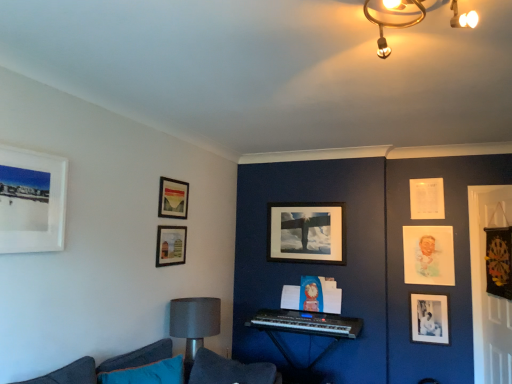
What is the approximate height of pastel paper portrait at right, the 6th picture frame from the front?

pastel paper portrait at right, the 6th picture frame from the front, is 20.11 inches in height.

The width and height of the screenshot is (512, 384). Describe the element at coordinates (499, 261) in the screenshot. I see `velvet black dartboard at right, which is the 1th picture frame in right-to-left order` at that location.

Where is `velvet black dartboard at right, which is the 1th picture frame in right-to-left order`? The height and width of the screenshot is (384, 512). velvet black dartboard at right, which is the 1th picture frame in right-to-left order is located at coordinates (499, 261).

Looking at this image, what is the approximate width of black matte photo frame at lower right, the 4th picture frame in the right-to-left sequence?

It is 1.70 inches.

This screenshot has height=384, width=512. What are the coordinates of `pastel paper portrait at right, which appears as the third picture frame when viewed from the back` in the screenshot? It's located at (428, 255).

Is point (181, 262) positioned in front of point (300, 313)?

Yes, it is.

Considering the positions of objects matte glass picture frame at upper center, acting as the 3th picture frame starting from the front, and black plastic keyboard at center in the image provided, who is more to the right, matte glass picture frame at upper center, acting as the 3th picture frame starting from the front, or black plastic keyboard at center?

black plastic keyboard at center is more to the right.

Between matte glass picture frame at upper center, which appears as the sixth picture frame when viewed from the back, and black plastic keyboard at center, which one has larger width?

With larger width is black plastic keyboard at center.

Between matte glass picture frame at upper center, placed as the 7th picture frame when sorted from right to left, and black plastic keyboard at center, which one has less height?

matte glass picture frame at upper center, placed as the 7th picture frame when sorted from right to left.

From a real-world perspective, is teal fabric pillow at lower left positioned over pastel paper portrait at right, which appears as the third picture frame when viewed from the back, based on gravity?

No.

Which of these two, teal fabric pillow at lower left or pastel paper portrait at right, the 6th picture frame from the left, is smaller?

pastel paper portrait at right, the 6th picture frame from the left, is smaller.

Considering the sizes of objects teal fabric pillow at lower left and pastel paper portrait at right, the 6th picture frame from the front, in the image provided, who is thinner, teal fabric pillow at lower left or pastel paper portrait at right, the 6th picture frame from the front,?

pastel paper portrait at right, the 6th picture frame from the front, is thinner.

Can you confirm if white paper at upper right, which is the seventh picture frame in left-to-right order, is bigger than velvet black dartboard at right, placed as the 2th picture frame when sorted from front to back?

No, white paper at upper right, which is the seventh picture frame in left-to-right order, is not bigger than velvet black dartboard at right, placed as the 2th picture frame when sorted from front to back.

Can you confirm if white paper at upper right, the 7th picture frame positioned from the front, is shorter than velvet black dartboard at right, which is the 7th picture frame in back-to-front order?

Yes, white paper at upper right, the 7th picture frame positioned from the front, is shorter than velvet black dartboard at right, which is the 7th picture frame in back-to-front order.

From the image's perspective, which one is positioned lower, white paper at upper right, which is the seventh picture frame in left-to-right order, or velvet black dartboard at right, which is the 7th picture frame in back-to-front order?

velvet black dartboard at right, which is the 7th picture frame in back-to-front order, is shown below in the image.

From a real-world perspective, which object rests below the other?

In real-world perspective, velvet black dartboard at right, the 8th picture frame viewed from the left, is lower.

What's the angular difference between black plastic keyboard at center and matte wooden picture frame at center, the first picture frame from the back,'s facing directions?

black plastic keyboard at center and matte wooden picture frame at center, the first picture frame from the back, are facing 1.56 degrees away from each other.

Which is behind, point (289, 328) or point (280, 247)?

The point (280, 247) is farther.

Based on their sizes in the image, would you say black plastic keyboard at center is bigger or smaller than matte wooden picture frame at center, which is the fifth picture frame from right to left?

Considering their sizes, black plastic keyboard at center takes up more space than matte wooden picture frame at center, which is the fifth picture frame from right to left.

Is black plastic keyboard at center not close to matte wooden picture frame at center, marked as the 8th picture frame in a front-to-back arrangement?

No, black plastic keyboard at center is not far away from matte wooden picture frame at center, marked as the 8th picture frame in a front-to-back arrangement.

From the image's perspective, which is above, pastel paper portrait at right, the 6th picture frame from the front, or matte black picture frame at upper left, which ranks as the 6th picture frame in right-to-left order?

From the image's view, matte black picture frame at upper left, which ranks as the 6th picture frame in right-to-left order, is above.

Considering the positions of objects pastel paper portrait at right, the 6th picture frame from the left, and matte black picture frame at upper left, which ranks as the 6th picture frame in right-to-left order, in the image provided, who is behind, pastel paper portrait at right, the 6th picture frame from the left, or matte black picture frame at upper left, which ranks as the 6th picture frame in right-to-left order,?

pastel paper portrait at right, the 6th picture frame from the left, is further away from the camera.

Considering the positions of point (412, 243) and point (178, 208), is point (412, 243) closer or farther from the camera than point (178, 208)?

Clearly, point (412, 243) is more distant from the camera than point (178, 208).

Is pastel paper portrait at right, which appears as the third picture frame when viewed from the back, oriented towards matte black picture frame at upper left, arranged as the 4th picture frame when viewed from the front?

No, pastel paper portrait at right, which appears as the third picture frame when viewed from the back, is not facing towards matte black picture frame at upper left, arranged as the 4th picture frame when viewed from the front.

Is black plastic keyboard at center taller than teal fabric pillow at lower left?

Indeed, black plastic keyboard at center has a greater height compared to teal fabric pillow at lower left.

Is black plastic keyboard at center closer to camera compared to teal fabric pillow at lower left?

No, it is not.

Consider the image. Is teal fabric pillow at lower left at the back of black plastic keyboard at center?

No, teal fabric pillow at lower left is not at the back of black plastic keyboard at center.

Looking at this image, is there a large distance between black plastic keyboard at center and teal fabric pillow at lower left?

Yes, black plastic keyboard at center and teal fabric pillow at lower left are quite far apart.

From the image's perspective, who appears lower, gold metallic chandelier at upper center or velvet black dartboard at right, which is the 7th picture frame in back-to-front order?

velvet black dartboard at right, which is the 7th picture frame in back-to-front order, appears lower in the image.

You are a GUI agent. You are given a task and a screenshot of the screen. Output one action in this format:
    pyautogui.click(x=<x>, y=<y>)
    Task: Click on the lamp above the velvet black dartboard at right, which is the 7th picture frame in back-to-front order (from the image's perspective)
    Image resolution: width=512 pixels, height=384 pixels.
    Given the screenshot: What is the action you would take?
    pyautogui.click(x=392, y=22)

Which object is positioned more to the right, gold metallic chandelier at upper center or velvet black dartboard at right, which is the 1th picture frame in right-to-left order?

Positioned to the right is velvet black dartboard at right, which is the 1th picture frame in right-to-left order.

From a real-world perspective, count 4th picture frames upward from the black plastic keyboard at center and point to it. Please provide its 2D coordinates.

[(170, 245)]

At what (x,y) coordinates should I click in order to perform the action: click on pillow below the pastel paper portrait at right, the 6th picture frame from the front (from a real-world perspective). Please return your answer as a coordinate pair (x, y). This screenshot has width=512, height=384. Looking at the image, I should click on [146, 373].

Estimate the real-world distances between objects in this image. Which object is further from black plastic keyboard at center, velvet black dartboard at right, which is the 1th picture frame in right-to-left order, or white matte picture frame at upper left, placed as the first picture frame when sorted from left to right?

Among the two, white matte picture frame at upper left, placed as the first picture frame when sorted from left to right, is located further to black plastic keyboard at center.

From the image, which object appears to be farther from black matte photo frame at lower right, the 4th picture frame in the right-to-left sequence, pastel paper portrait at right, which ranks as the third picture frame in right-to-left order, or black plastic keyboard at center?

black plastic keyboard at center lies further to black matte photo frame at lower right, the 4th picture frame in the right-to-left sequence, than the other object.

Which object lies further to the anchor point gold metallic chandelier at upper center, matte wooden picture frame at center, the first picture frame from the back, or teal fabric pillow at lower left?

Based on the image, matte wooden picture frame at center, the first picture frame from the back, appears to be further to gold metallic chandelier at upper center.

Estimate the real-world distances between objects in this image. Which object is closer to pastel paper portrait at right, the 6th picture frame from the left, velvet black dartboard at right, the 8th picture frame viewed from the left, or teal fabric pillow at lower left?

velvet black dartboard at right, the 8th picture frame viewed from the left, lies closer to pastel paper portrait at right, the 6th picture frame from the left, than the other object.

Considering their positions, is black matte photo frame at lower right, which ranks as the fifth picture frame in front-to-back order, positioned closer to teal fabric pillow at lower left than matte gray table lamp at lower left?

matte gray table lamp at lower left is closer to teal fabric pillow at lower left.

Estimate the real-world distances between objects in this image. Which object is closer to white paper at upper right, which is the seventh picture frame in left-to-right order, gold metallic chandelier at upper center or pastel paper portrait at right, which appears as the third picture frame when viewed from the back?

pastel paper portrait at right, which appears as the third picture frame when viewed from the back, lies closer to white paper at upper right, which is the seventh picture frame in left-to-right order, than the other object.

Looking at this image, which object lies nearer to the anchor point white matte picture frame at upper left, placed as the first picture frame when sorted from front to back, matte black picture frame at upper left, placed as the 3th picture frame when sorted from left to right, or gold metallic chandelier at upper center?

matte black picture frame at upper left, placed as the 3th picture frame when sorted from left to right, is closer to white matte picture frame at upper left, placed as the first picture frame when sorted from front to back.

Looking at the image, which one is located further to matte black picture frame at upper left, placed as the 3th picture frame when sorted from left to right, matte wooden picture frame at center, the 4th picture frame in the left-to-right sequence, or velvet black dartboard at right, placed as the 2th picture frame when sorted from front to back?

velvet black dartboard at right, placed as the 2th picture frame when sorted from front to back, is further to matte black picture frame at upper left, placed as the 3th picture frame when sorted from left to right.

You are a GUI agent. You are given a task and a screenshot of the screen. Output one action in this format:
    pyautogui.click(x=<x>, y=<y>)
    Task: Click on the lamp located between matte gray table lamp at lower left and velvet black dartboard at right, placed as the 2th picture frame when sorted from front to back, in the left-right direction
    This screenshot has height=384, width=512.
    Given the screenshot: What is the action you would take?
    pyautogui.click(x=392, y=22)

Identify the location of pillow situated between white matte picture frame at upper left, placed as the first picture frame when sorted from front to back, and black plastic keyboard at center from left to right. (146, 373).

At what (x,y) coordinates should I click in order to perform the action: click on picture frame located between teal fabric pillow at lower left and black matte photo frame at lower right, which is counted as the 5th picture frame, starting from the left, in the left-right direction. Please return your answer as a coordinate pair (x, y). The height and width of the screenshot is (384, 512). Looking at the image, I should click on (306, 233).

At what (x,y) coordinates should I click in order to perform the action: click on table lamp between matte black picture frame at upper left, placed as the 3th picture frame when sorted from left to right, and white paper at upper right, which is the seventh picture frame in left-to-right order. Please return your answer as a coordinate pair (x, y). The width and height of the screenshot is (512, 384). Looking at the image, I should click on 194,324.